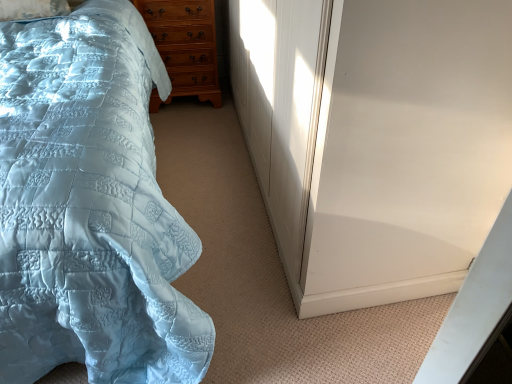
Question: Based on their positions, is white glossy screen door at right located to the left or right of light brown wooden chest of drawers at upper left?

Choices:
 (A) left
 (B) right

Answer: (B)

Question: In terms of width, does white glossy screen door at right look wider or thinner when compared to light brown wooden chest of drawers at upper left?

Choices:
 (A) wide
 (B) thin

Answer: (A)

Question: Estimate the real-world distances between objects in this image. Which object is farther from the light brown wooden chest of drawers at upper left?

Choices:
 (A) light blue quilted bed at left
 (B) white glossy screen door at right

Answer: (B)

Question: Based on their relative distances, which object is farther from the light blue quilted bed at left?

Choices:
 (A) white glossy screen door at right
 (B) light brown wooden chest of drawers at upper left

Answer: (B)